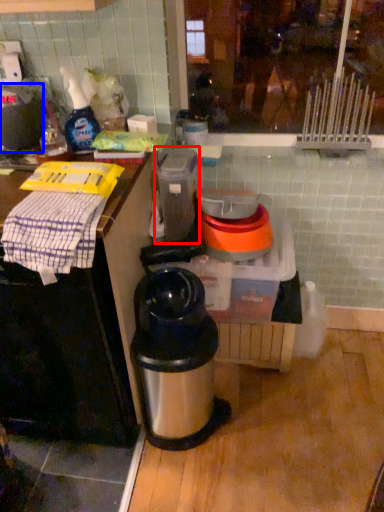
Question: Which point is further to the camera, appliance (highlighted by a red box) or kitchen appliance (highlighted by a blue box)?

Choices:
 (A) appliance
 (B) kitchen appliance

Answer: (A)